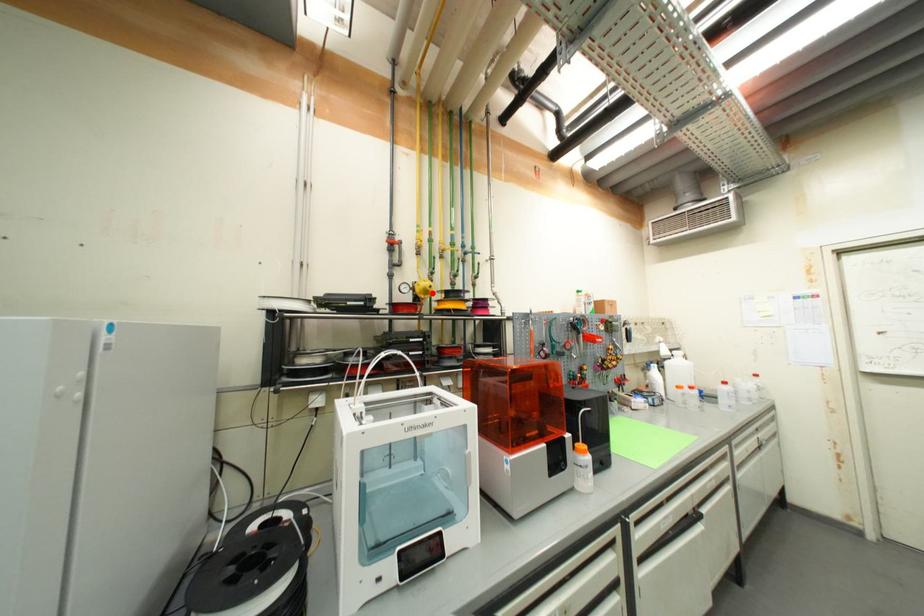
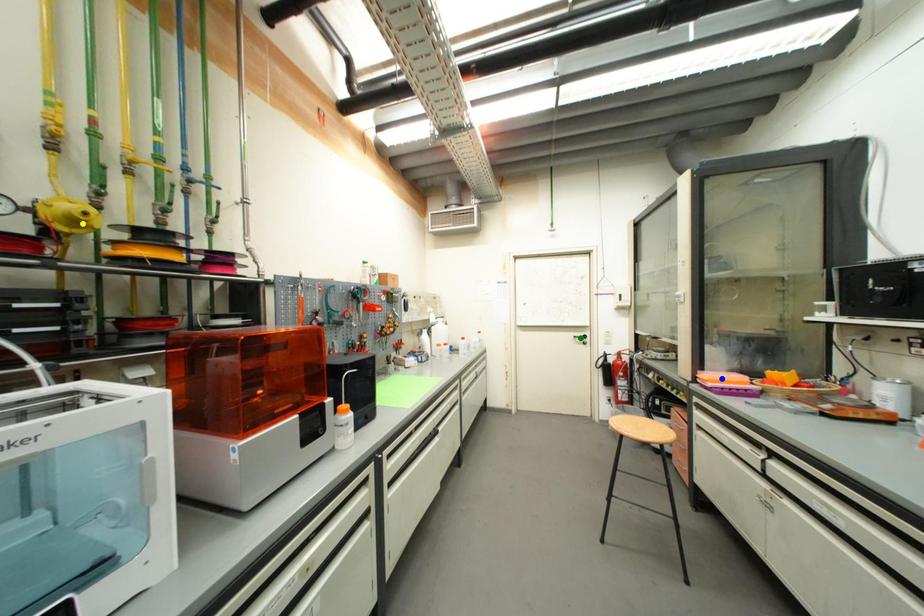
Question: I am providing you with two images of the same scene from different viewpoints. A red point is marked on the first image. You are given multiple points on the second image. Which mark in image 2 goes with the point in image 1?

Choices:
 (A) yellow point
 (B) green point
 (C) blue point

Answer: (A)